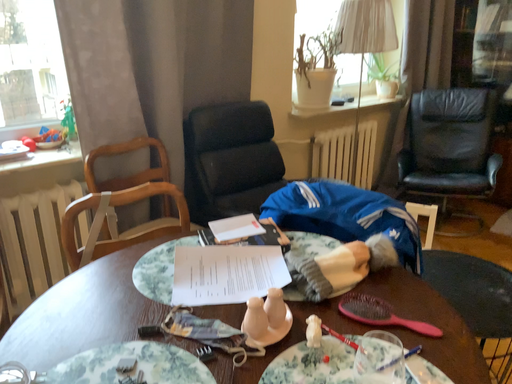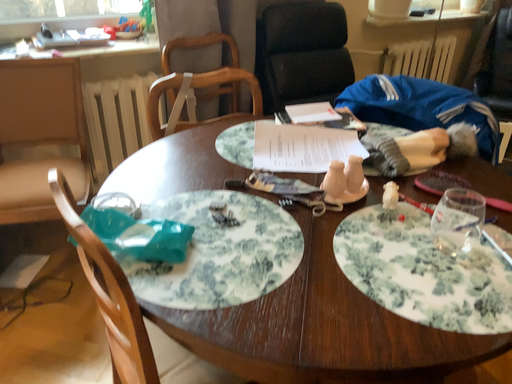
Question: How did the camera likely rotate when shooting the video?

Choices:
 (A) rotated left
 (B) rotated right

Answer: (A)